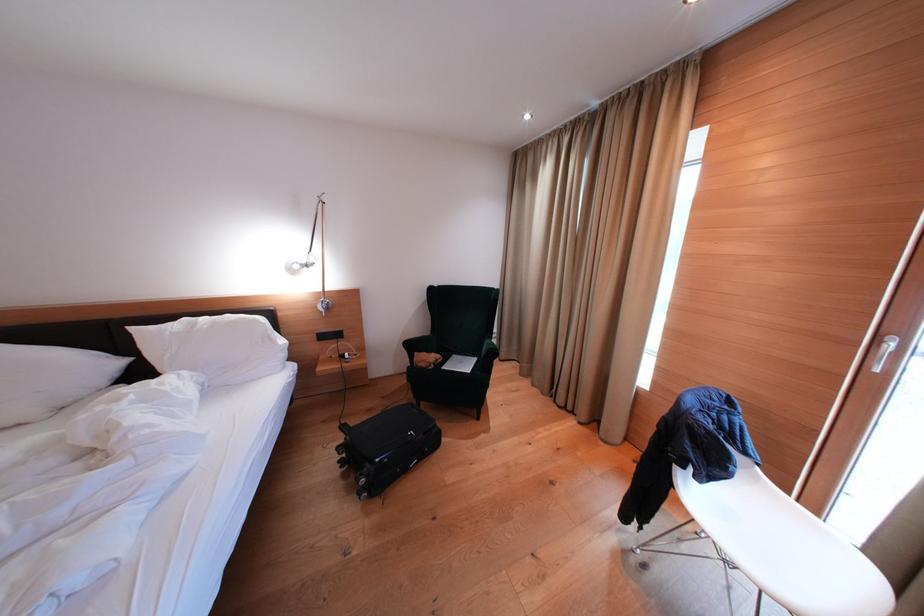
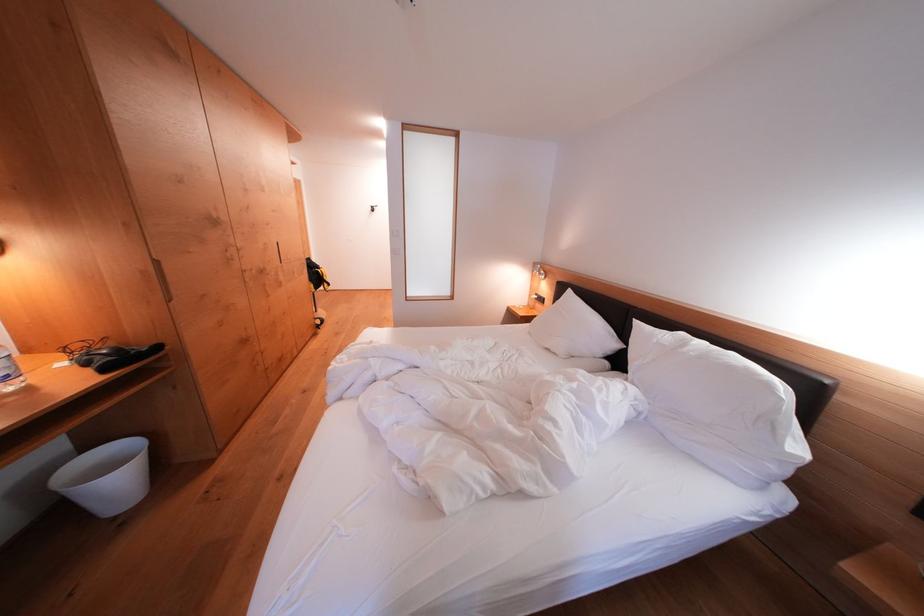
First-person continuous shooting, in which direction is the camera rotating?

The camera's rotation is toward left-down.